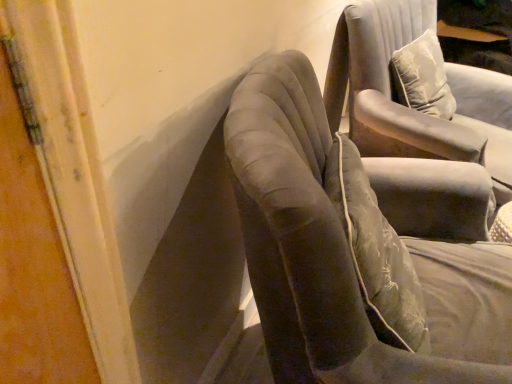
Question: In terms of width, does velvet gray chair at center, positioned as the first chair in front-to-back order, look wider or thinner when compared to suede-like gray chair at upper right, which is counted as the 2th chair, starting from the front?

Choices:
 (A) thin
 (B) wide

Answer: (B)

Question: In the image, is velvet gray chair at center, which is counted as the second chair, starting from the back, positioned in front of or behind suede-like gray chair at upper right, which is counted as the 2th chair, starting from the front?

Choices:
 (A) front
 (B) behind

Answer: (A)

Question: Looking at the image, does velvet gray chair at center, positioned as the first chair in front-to-back order, seem bigger or smaller compared to suede-like gray chair at upper right, placed as the first chair when sorted from back to front?

Choices:
 (A) small
 (B) big

Answer: (B)

Question: Considering the positions of suede-like gray chair at upper right, placed as the first chair when sorted from back to front, and velvet gray chair at center, positioned as the first chair in front-to-back order, in the image, is suede-like gray chair at upper right, placed as the first chair when sorted from back to front, taller or shorter than velvet gray chair at center, positioned as the first chair in front-to-back order,?

Choices:
 (A) short
 (B) tall

Answer: (A)

Question: Do you think suede-like gray chair at upper right, placed as the first chair when sorted from back to front, is within velvet gray chair at center, positioned as the first chair in front-to-back order, or outside of it?

Choices:
 (A) inside
 (B) outside

Answer: (B)

Question: From a real-world perspective, relative to velvet gray chair at center, which is counted as the second chair, starting from the back, is suede-like gray chair at upper right, placed as the first chair when sorted from back to front, vertically above or below?

Choices:
 (A) above
 (B) below

Answer: (A)

Question: Looking at the image, does suede-like gray chair at upper right, placed as the first chair when sorted from back to front, seem bigger or smaller compared to velvet gray chair at center, positioned as the first chair in front-to-back order?

Choices:
 (A) big
 (B) small

Answer: (B)